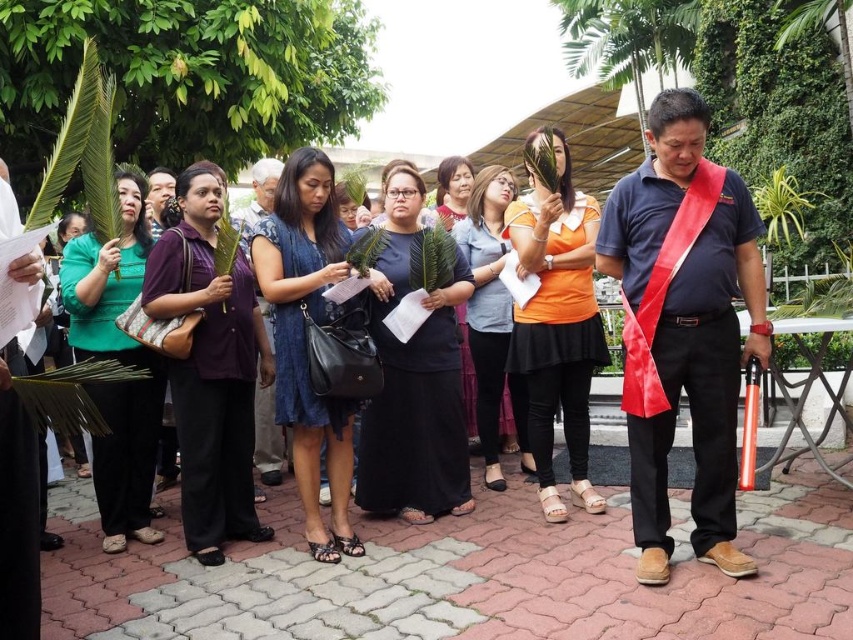
Is purple fabric dress at center in front of black matte dress at center?

Yes, purple fabric dress at center is closer to the viewer.

Is point (154, 301) more distant than point (430, 342)?

That is False.

Is point (239, 269) closer to viewer compared to point (424, 424)?

Yes, it is.

Image resolution: width=853 pixels, height=640 pixels. I want to click on purple fabric dress at center, so click(x=210, y=369).

Which is more to the left, black matte dress at center or orange matte shirt at center?

Positioned to the left is black matte dress at center.

Is point (438, 304) less distant than point (550, 432)?

Yes, it is.

Does point (434, 512) come closer to viewer compared to point (590, 372)?

No, it is behind (590, 372).

Image resolution: width=853 pixels, height=640 pixels. I want to click on black matte dress at center, so click(415, 381).

Does point (277, 364) come behind point (477, 209)?

No, (277, 364) is in front of (477, 209).

Measure the distance between point (276, 340) and camera.

Point (276, 340) is 4.49 meters from camera.

Image resolution: width=853 pixels, height=640 pixels. Identify the location of blue denim dress at center. (306, 337).